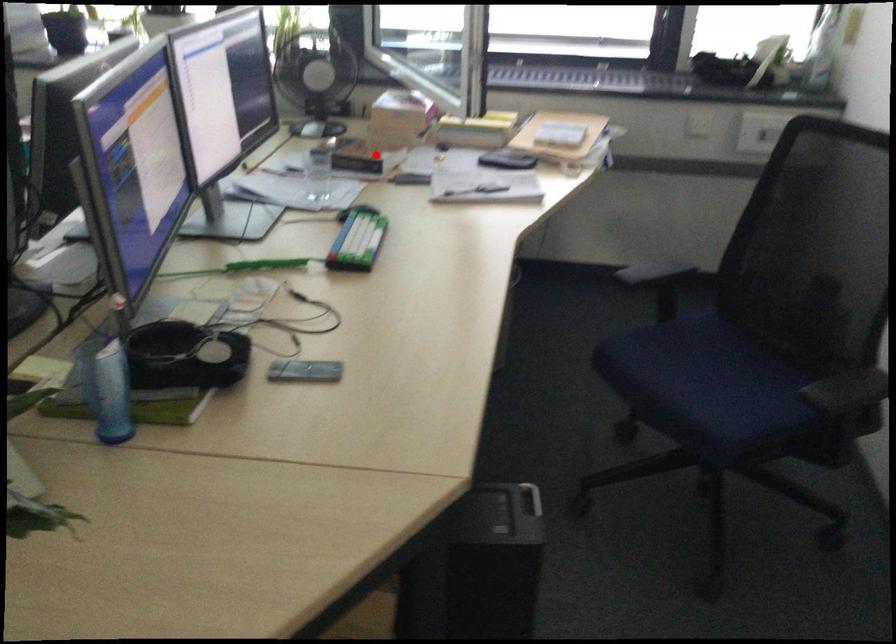
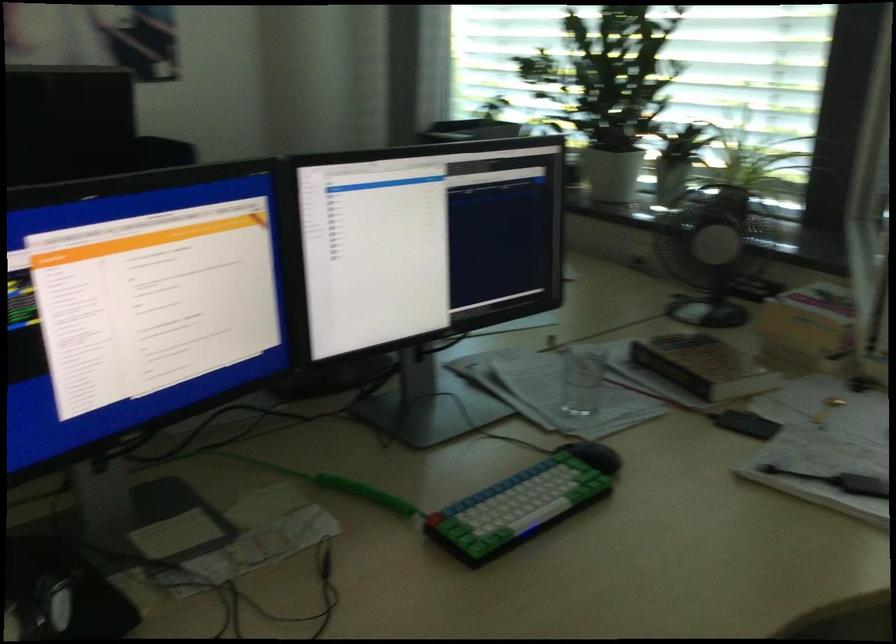
In the second image, find the point that corresponds to the highlighted location in the first image.

(703, 366)